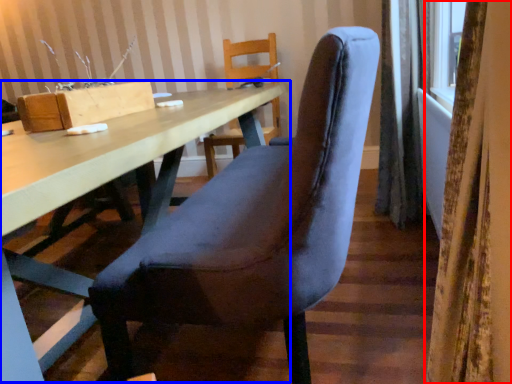
Question: Which object appears closest to the camera in this image, curtain (highlighted by a red box) or table (highlighted by a blue box)?

Choices:
 (A) curtain
 (B) table

Answer: (A)